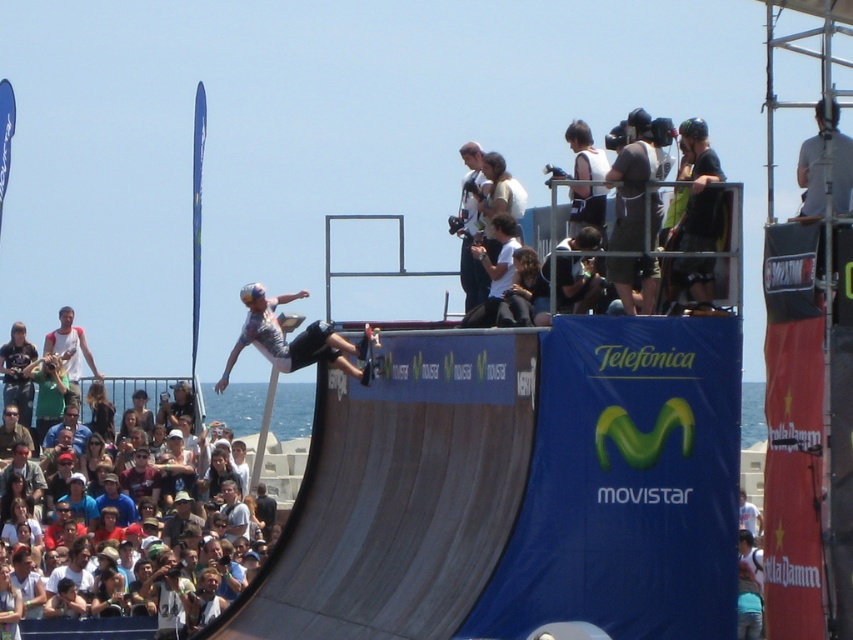
Question: Is matte gray helmet at center above black matte skateboard at center?

Choices:
 (A) yes
 (B) no

Answer: (A)

Question: Does matte gray helmet at center have a larger size compared to black matte skateboard at center?

Choices:
 (A) no
 (B) yes

Answer: (B)

Question: Estimate the real-world distances between objects in this image. Which object is farther from the black matte skateboard at center?

Choices:
 (A) white cotton t-shirt at lower left
 (B) matte gray helmet at center

Answer: (A)

Question: Does matte gray helmet at center lie in front of white cotton t-shirt at lower left?

Choices:
 (A) yes
 (B) no

Answer: (A)

Question: Which point is closer to the camera?

Choices:
 (A) (357, 342)
 (B) (55, 634)
 (C) (265, 324)

Answer: (A)

Question: Among these objects, which one is farthest from the camera?

Choices:
 (A) matte gray helmet at center
 (B) white cotton t-shirt at lower left

Answer: (B)